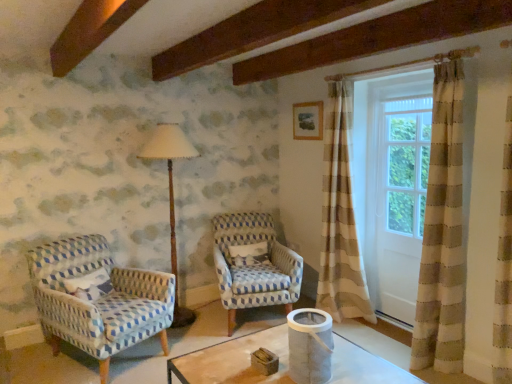
At what (x,y) coordinates should I click in order to perform the action: click on vacant area situated below wooden floor lamp at left (from a real-world perspective). Please return your answer as a coordinate pair (x, y). Looking at the image, I should click on (186, 321).